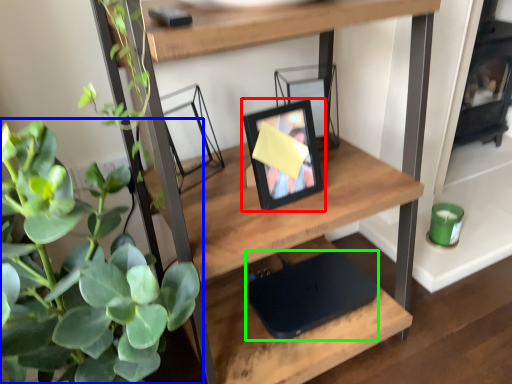
Question: Which is nearer to the picture frame (highlighted by a red box)? houseplant (highlighted by a blue box) or laptop (highlighted by a green box).

Choices:
 (A) houseplant
 (B) laptop

Answer: (B)